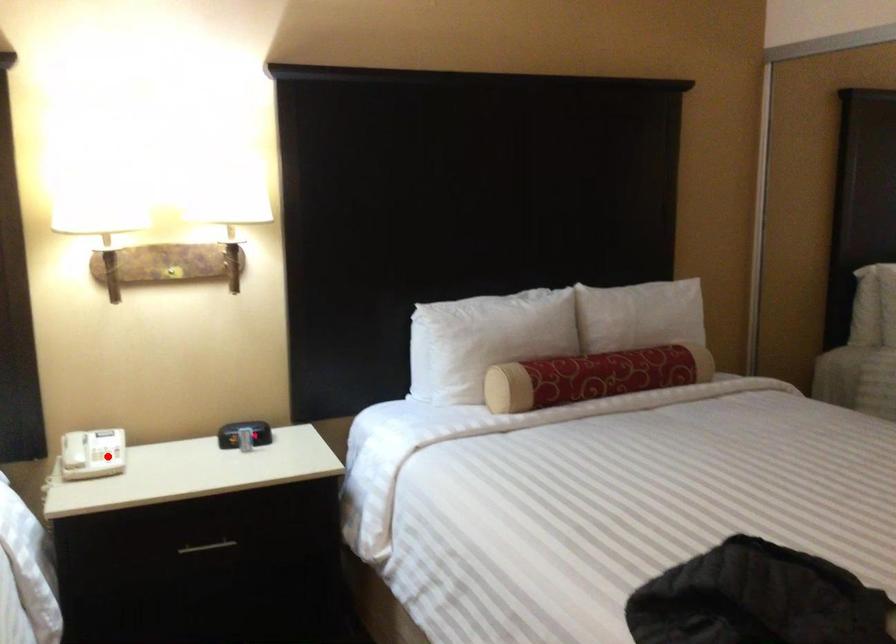
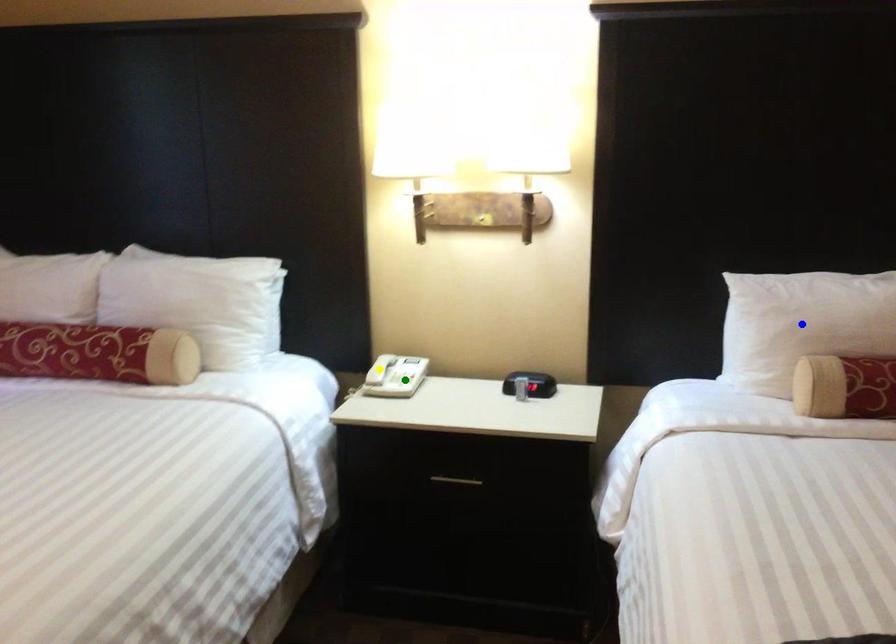
Question: I am providing you with two images of the same scene from different viewpoints. A red point is marked on the first image. You are given multiple points on the second image. In image 2, which mark is for the same physical point as the one in image 1?

Choices:
 (A) yellow point
 (B) green point
 (C) blue point

Answer: (B)